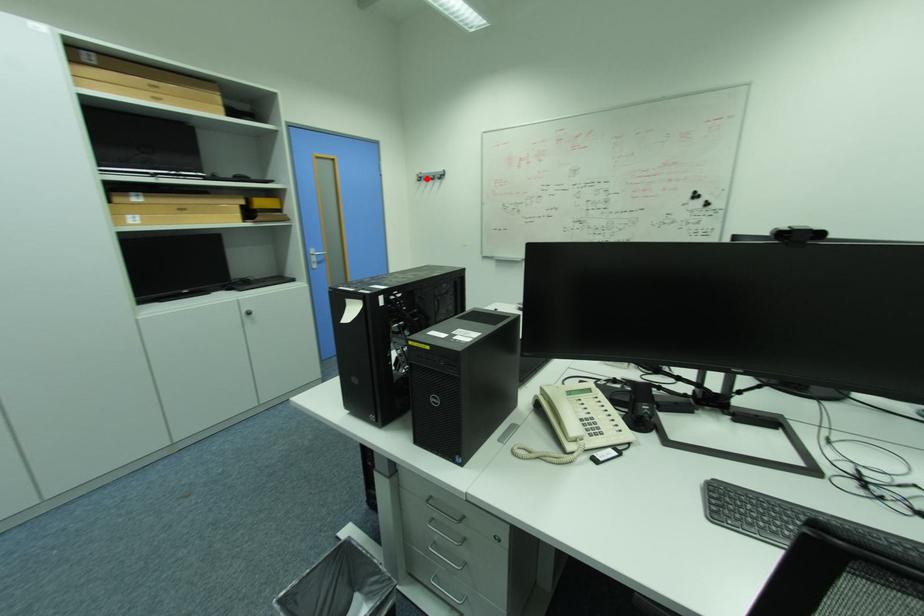
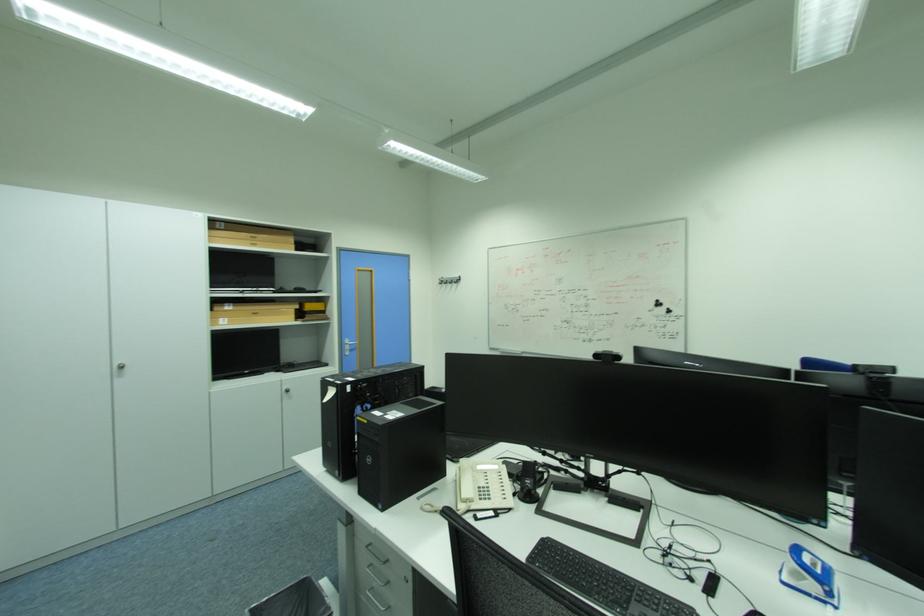
Find the pixel in the second image that matches the highlighted location in the first image.

(448, 282)